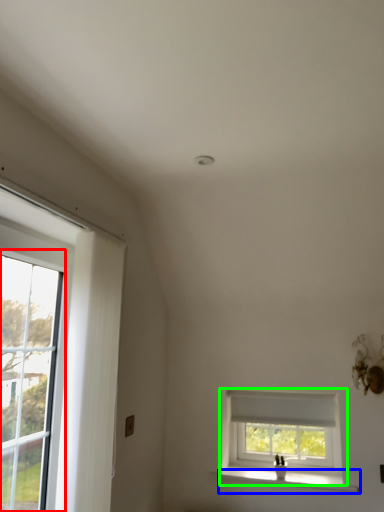
Question: Which object is positioned closest to glass door (highlighted by a red box)? Select from window sill (highlighted by a blue box) and window (highlighted by a green box).

Choices:
 (A) window sill
 (B) window

Answer: (A)